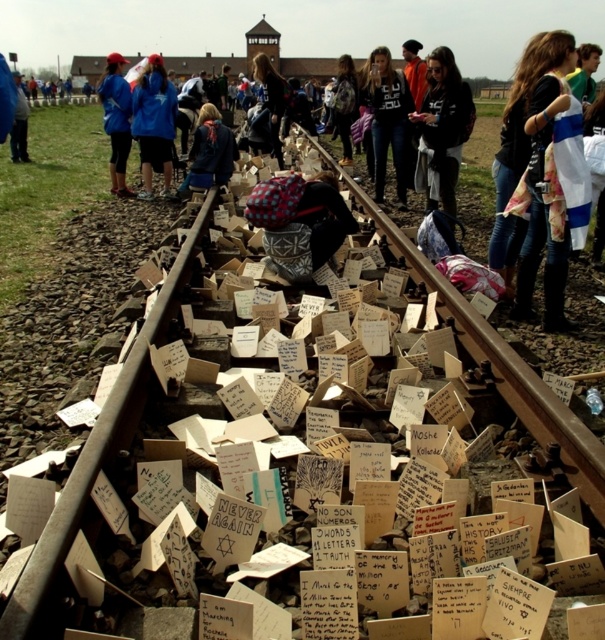
Is denim jacket at center below dark brown leather jacket at center?

Yes.

Which is above, denim jacket at center or dark brown leather jacket at center?

dark brown leather jacket at center is above.

The height and width of the screenshot is (640, 605). What do you see at coordinates (548, 173) in the screenshot? I see `denim jacket at center` at bounding box center [548, 173].

Identify the location of denim jacket at center. The width and height of the screenshot is (605, 640). (548, 173).

Can you confirm if blue fleece jacket at upper left is positioned to the left of dark brown leather jacket at center?

Yes, blue fleece jacket at upper left is to the left of dark brown leather jacket at center.

Does blue fleece jacket at upper left have a lesser width compared to dark brown leather jacket at center?

No.

Describe the element at coordinates (116, 120) in the screenshot. I see `blue fleece jacket at upper left` at that location.

You are a GUI agent. You are given a task and a screenshot of the screen. Output one action in this format:
    pyautogui.click(x=<x>, y=<y>)
    Task: Click on the blue fleece jacket at upper left
    The height and width of the screenshot is (640, 605).
    Given the screenshot: What is the action you would take?
    pyautogui.click(x=116, y=120)

Between plaid fabric hat at center and dark blue jacket at left, which one appears on the left side from the viewer's perspective?

dark blue jacket at left is more to the left.

Does plaid fabric hat at center have a lesser width compared to dark blue jacket at left?

Correct, plaid fabric hat at center's width is less than dark blue jacket at left's.

This screenshot has width=605, height=640. What are the coordinates of `plaid fabric hat at center` in the screenshot? It's located at (344, 104).